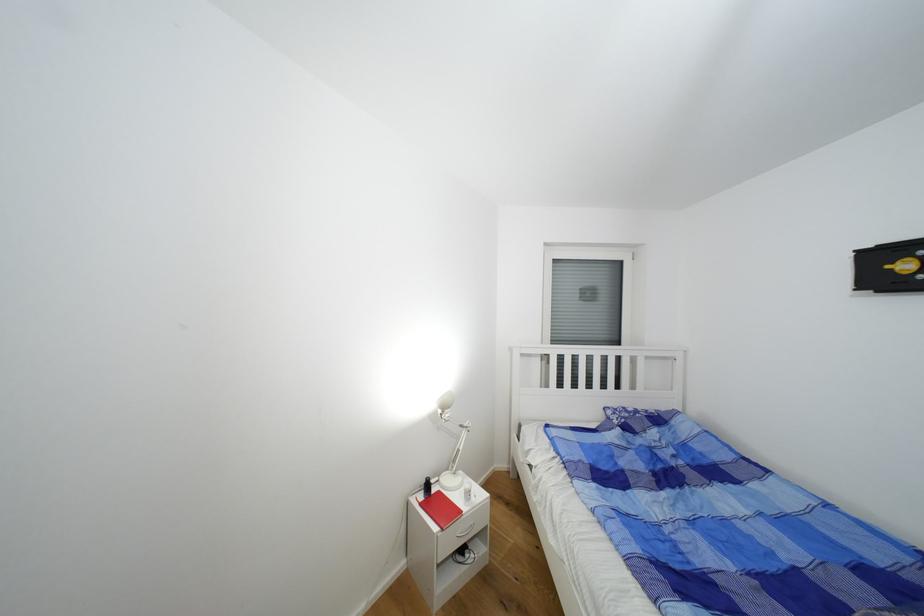
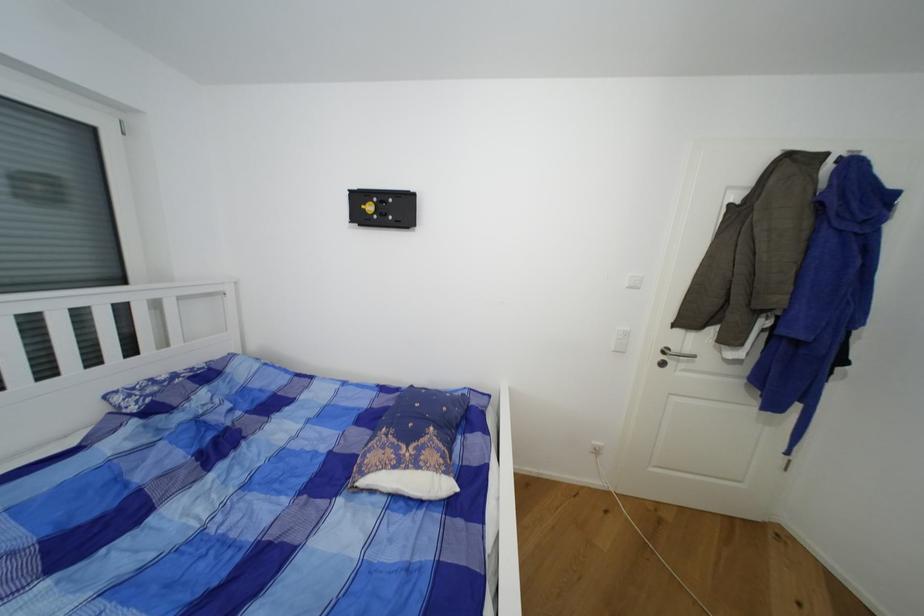
Question: The camera is either moving clockwise (left) or counter-clockwise (right) around the object. The first image is from the beginning of the video and the second image is from the end. Is the camera moving left or right when shooting the video?

Choices:
 (A) Left
 (B) Right

Answer: (A)